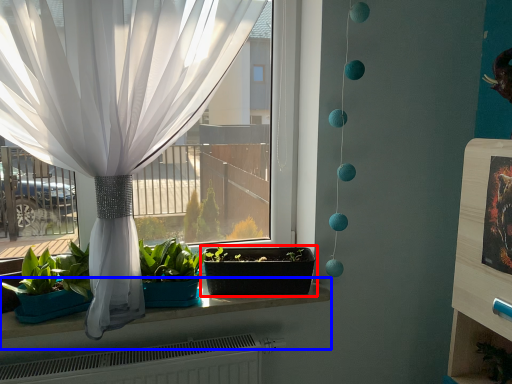
Question: Which of the following is the closest to the observer, flowerpot (highlighted by a red box) or window sill (highlighted by a blue box)?

Choices:
 (A) flowerpot
 (B) window sill

Answer: (B)